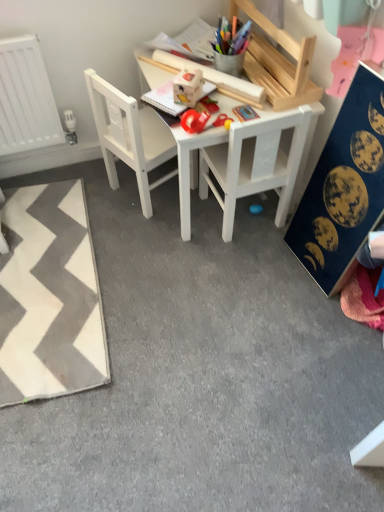
You are a GUI agent. You are given a task and a screenshot of the screen. Output one action in this format:
    pyautogui.click(x=<x>, y=<y>)
    Task: Click on the free space between dark blue fabric with celestial prints at right and white zigzag rug at lower left
    The height and width of the screenshot is (512, 384).
    Given the screenshot: What is the action you would take?
    pyautogui.click(x=176, y=286)